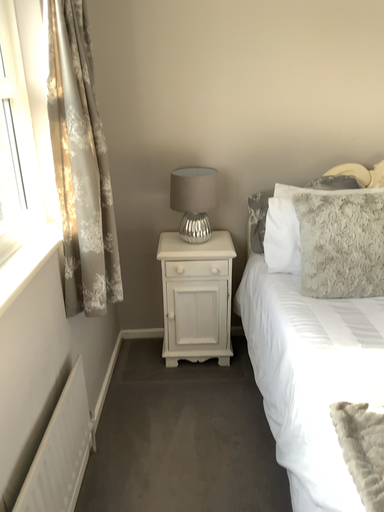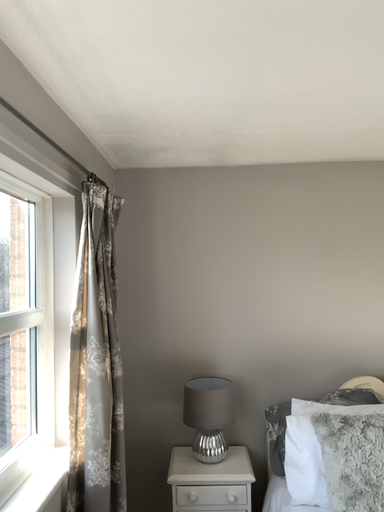
Question: How did the camera likely rotate when shooting the video?

Choices:
 (A) rotated downward
 (B) rotated upward

Answer: (B)